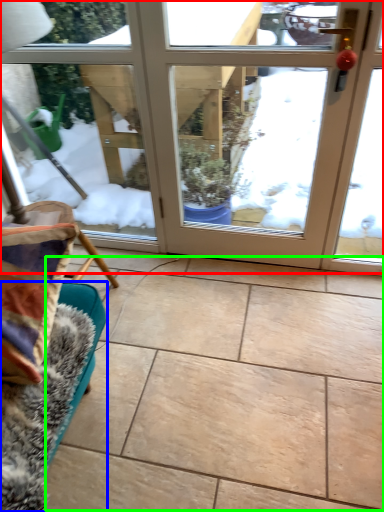
Question: Which is nearer to the door (highlighted by a red box)? furniture (highlighted by a blue box) or ceramic tile (highlighted by a green box).

Choices:
 (A) furniture
 (B) ceramic tile

Answer: (B)